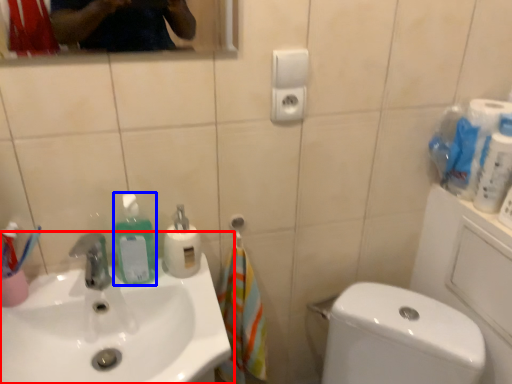
Question: Which of the following is the farthest to the observer, sink (highlighted by a red box) or cleaning product (highlighted by a blue box)?

Choices:
 (A) sink
 (B) cleaning product

Answer: (B)